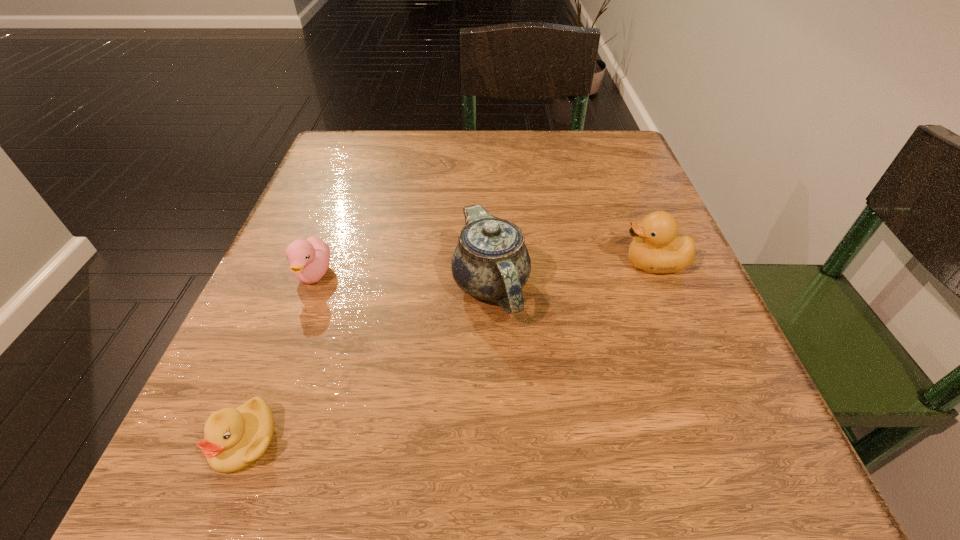
Locate an element on the screen. vacant space located 0.380m facing forward on the rightmost duckling is located at coordinates (387, 264).

Where is `vacant area located 0.230m on the front-facing side of the second shortest duckling`? The image size is (960, 540). vacant area located 0.230m on the front-facing side of the second shortest duckling is located at coordinates (252, 442).

I want to click on object that is at the near edge, so click(x=234, y=439).

In order to click on object that is at the right edge in this screenshot , I will do `click(657, 248)`.

Where is `object at the near left corner`? The width and height of the screenshot is (960, 540). object at the near left corner is located at coordinates (234, 439).

The width and height of the screenshot is (960, 540). Identify the location of vacant region at the far edge of the desktop. (475, 134).

Identify the location of blank area at the left edge. The image size is (960, 540). (294, 377).

The width and height of the screenshot is (960, 540). What are the coordinates of `free space at the right edge of the desktop` in the screenshot? It's located at [636, 278].

Find the location of a particular element. vacant space at the far left corner is located at coordinates (369, 132).

Locate an element on the screen. free spot at the near left corner of the desktop is located at coordinates (298, 451).